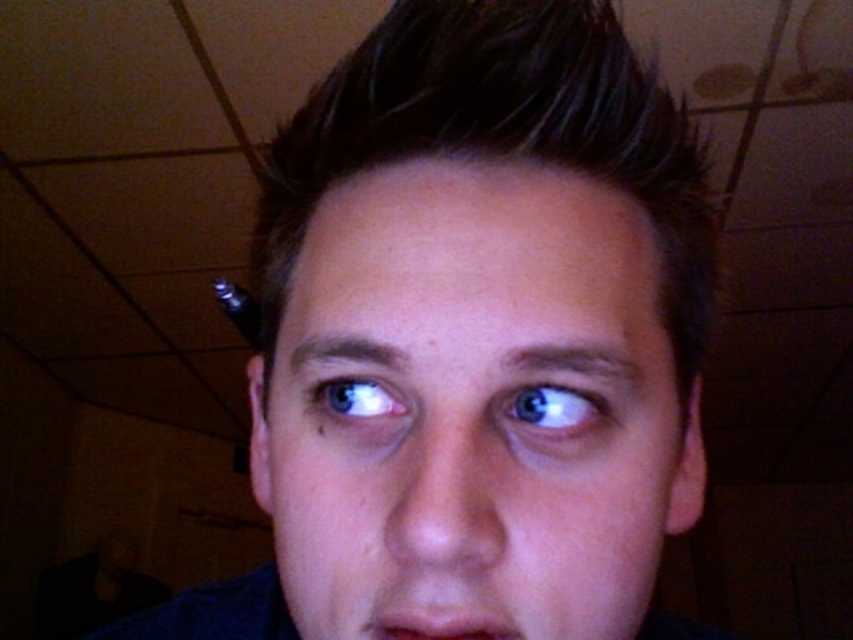
You are a photographer adjusting your camera settings in a dimly lit indoor studio with a ceiling grid. You notice the smooth skin face at center and the blue glossy eye at center in your frame. Based on their positions, which object should you focus on first to ensure proper lighting adjustment?

The smooth skin face at center is below the blue glossy eye at center, so you should focus on the blue glossy eye at center first since it is higher up and closer to the lighting source, ensuring accurate adjustments for both areas.

You are a makeup artist preparing to apply lipstick. You need to ensure the lipstick stays on the matte skin mouth at center without smudging. Considering the texture of the blue glossy eye at upper center nearby, which area might require more careful application to avoid smudging?

The matte skin mouth at center requires careful application because it is much taller than the blue glossy eye at upper center, making it more prone to smudging if not applied precisely.